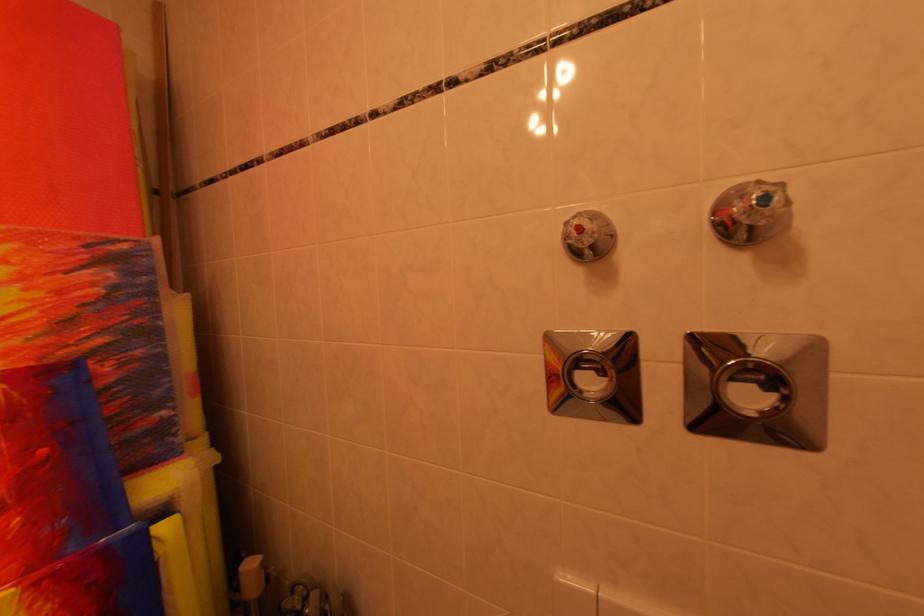
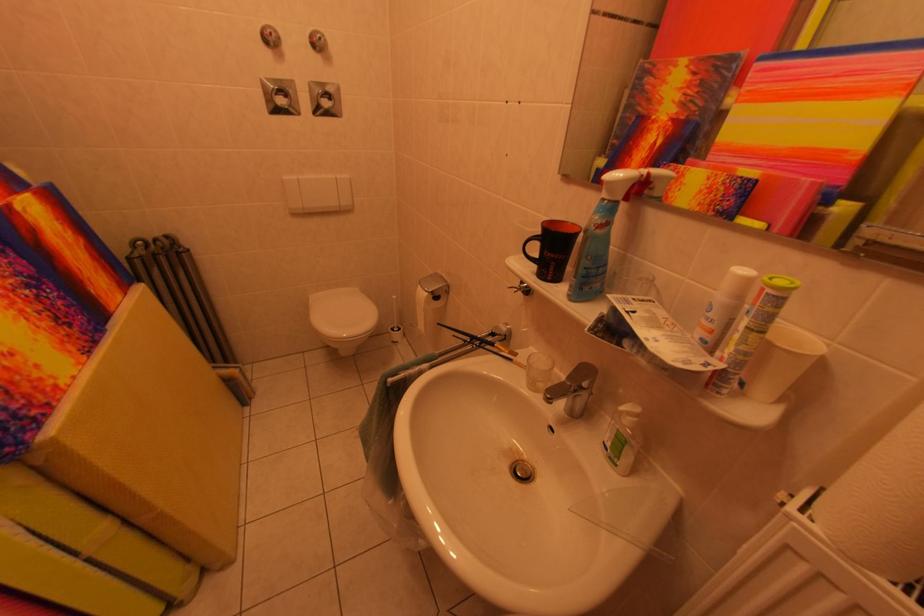
The point at (761, 390) is marked in the first image. Where is the corresponding point in the second image?

(334, 103)